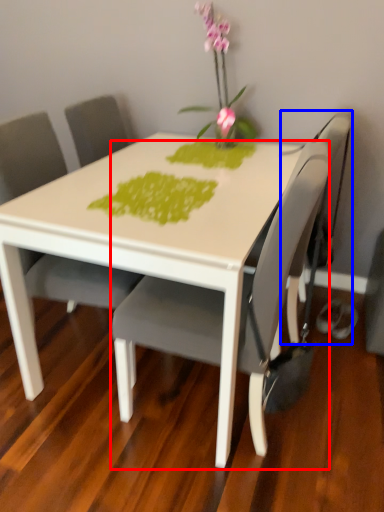
Question: Which object appears closest to the camera in this image, chair (highlighted by a red box) or swivel chair (highlighted by a blue box)?

Choices:
 (A) chair
 (B) swivel chair

Answer: (A)